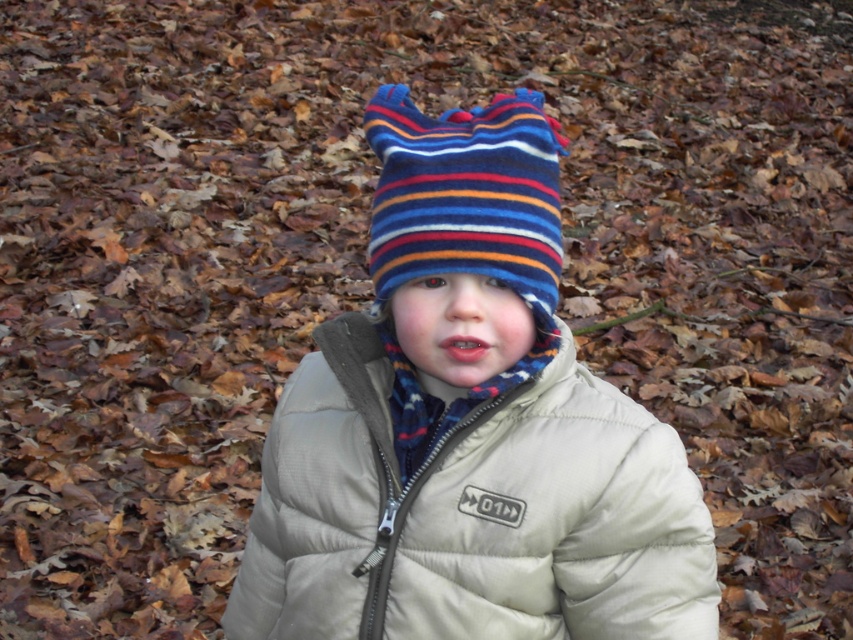
What are the coordinates of the beige quilted jacket at center?

The beige quilted jacket at center is located at point (471, 513).

You are a fashion designer observing the child in the scene. You need to determine if the beige quilted jacket at center can be worn over the striped woolen hat at center based on their sizes. Can it fit?

The beige quilted jacket at center has a greater height compared to the striped woolen hat at center, so yes, the jacket can be worn over the hat since it is taller.

You are a fashion designer observing the child in the image. You need to determine the spatial arrangement of the beige quilted jacket at center and the striped woolen hat at center. Which item is located to the left of the other?

The beige quilted jacket at center is positioned on the left side of striped woolen hat at center, so the beige quilted jacket at center is to the left of the striped woolen hat at center.